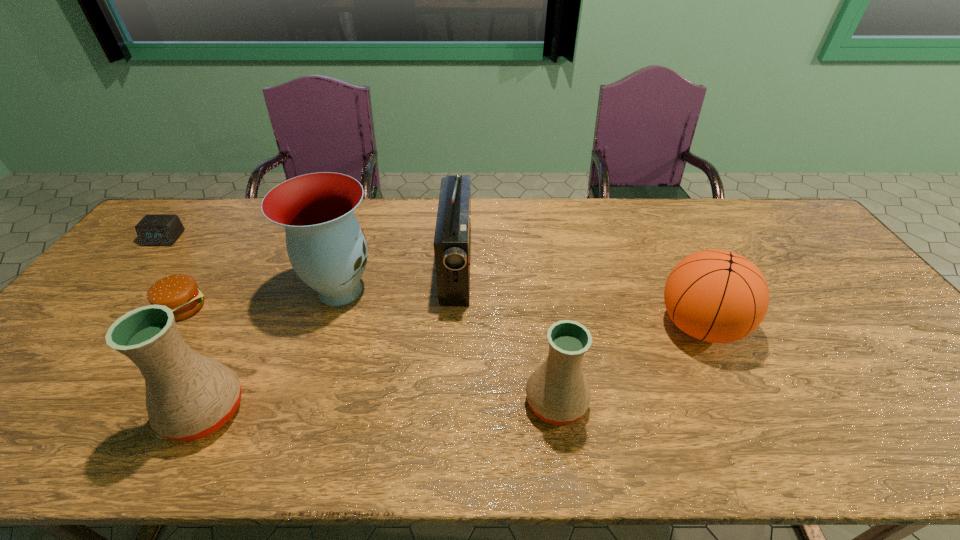
The image size is (960, 540). I want to click on vacant region that satisfies the following two spatial constraints: 1. on the front-facing side of the shortest object; 2. on the right side of the taller pottery, so click(17, 411).

Locate an element on the screen. free location that satisfies the following two spatial constraints: 1. on the front-facing side of the sixth object from left to right; 2. on the right side of the radio receiver is located at coordinates (449, 402).